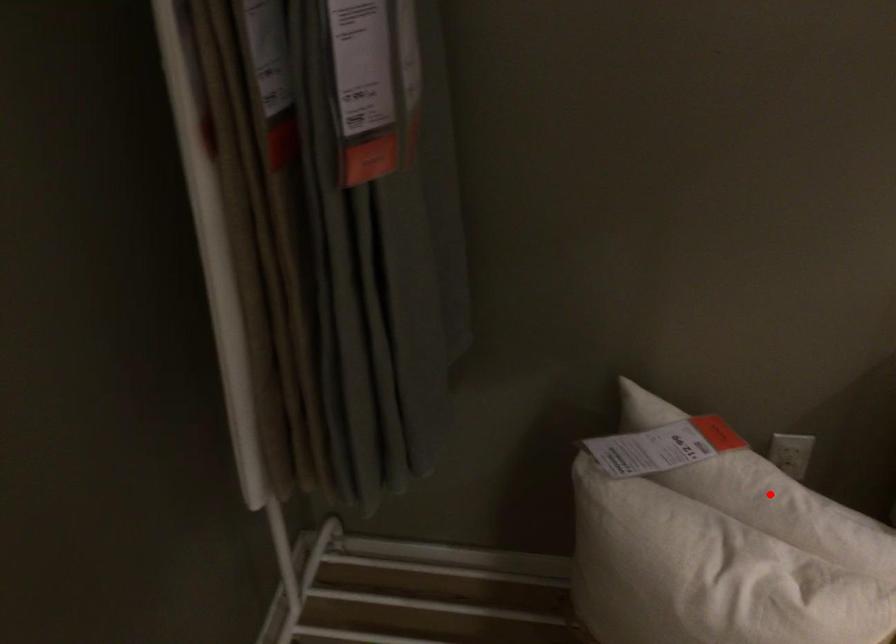
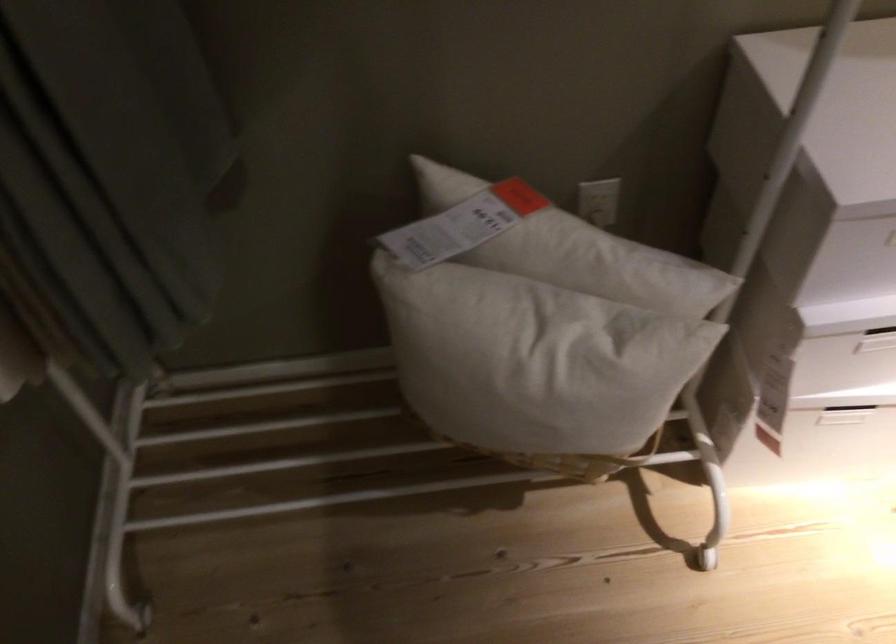
The point at the highlighted location is marked in the first image. Where is the corresponding point in the second image?

(572, 249)